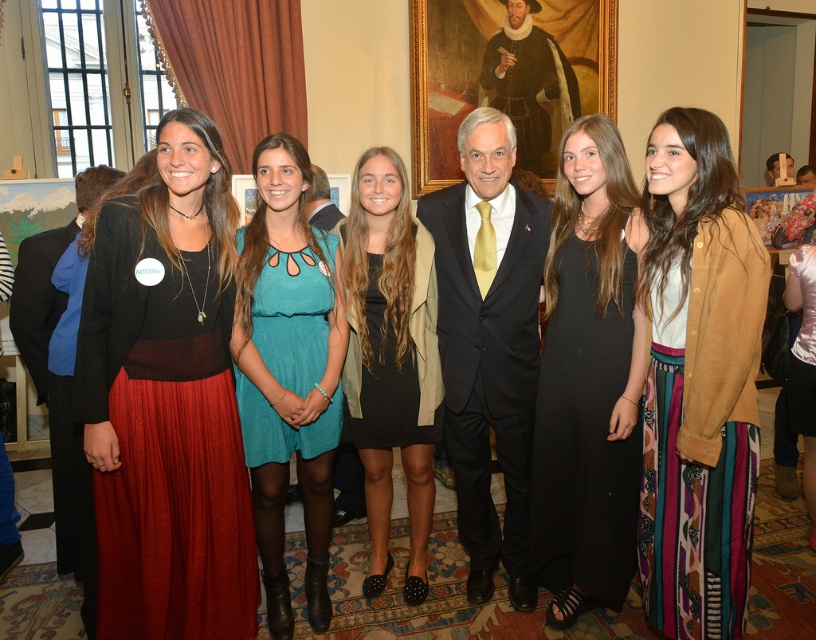
You are standing in the room and want to move from point A to point B. Point A is at coordinate point (568, 372) and point B is at coordinate point (304, 180). Considering the spatial arrangement of the room, which direction should you move to get closer to point B?

To move from point A at (568, 372) to point B at (304, 180), you should move towards the upper left direction since point B is located in that direction relative to point A.